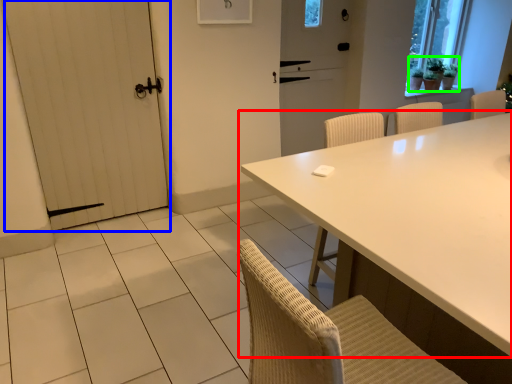
Question: Which object is positioned closest to table (highlighted by a red box)? Select from door (highlighted by a blue box) and plant (highlighted by a green box).

Choices:
 (A) door
 (B) plant

Answer: (A)